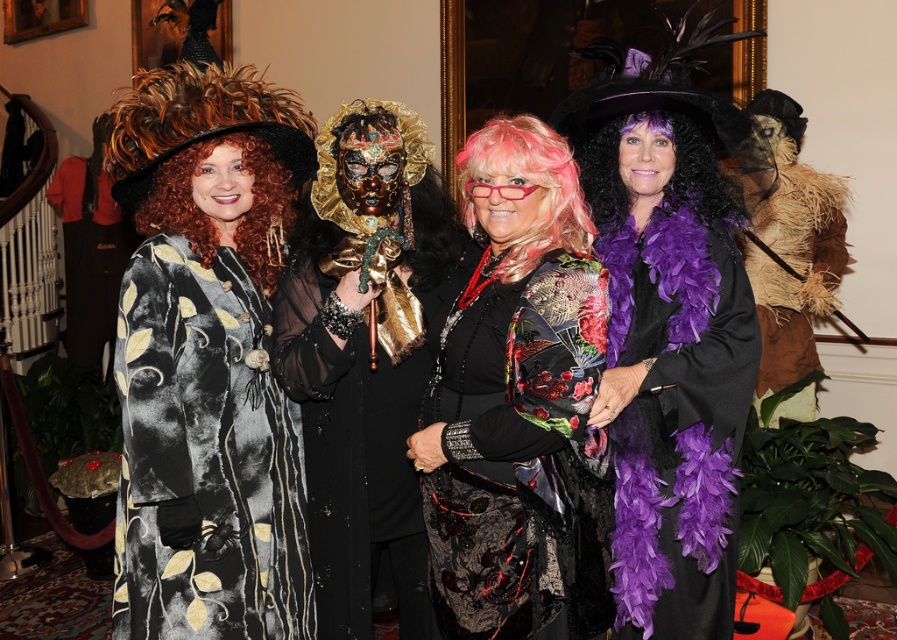
Looking at this image, you are a photographer at the event and want to take a photo of the gold metallic mask at center and the pink feathered wig at center. Which object should you focus on first if you want to capture both in the same frame without moving the camera?

The gold metallic mask at center is positioned under the pink feathered wig at center, so you should focus on the pink feathered wig at center first to ensure both are in the frame.

You are a photographer at the event and need to capture a clear shot of both the gold metallic mask at center and the pink feathered wig at center. Which object should you focus on first to ensure it appears sharp in the photo?

The gold metallic mask at center is further to the viewer than the pink feathered wig at center, so you should focus on the gold metallic mask at center first to ensure both appear sharp.

You are standing at the entrance of the room and want to locate the gold metallic mask at center. Based on the coordinates provided, where should you look relative to the four people in the foreground?

The gold metallic mask at center is located at coordinates point (364,356), which is in the center area of the image, so you should look towards the middle of the group of four people in the foreground to find it.